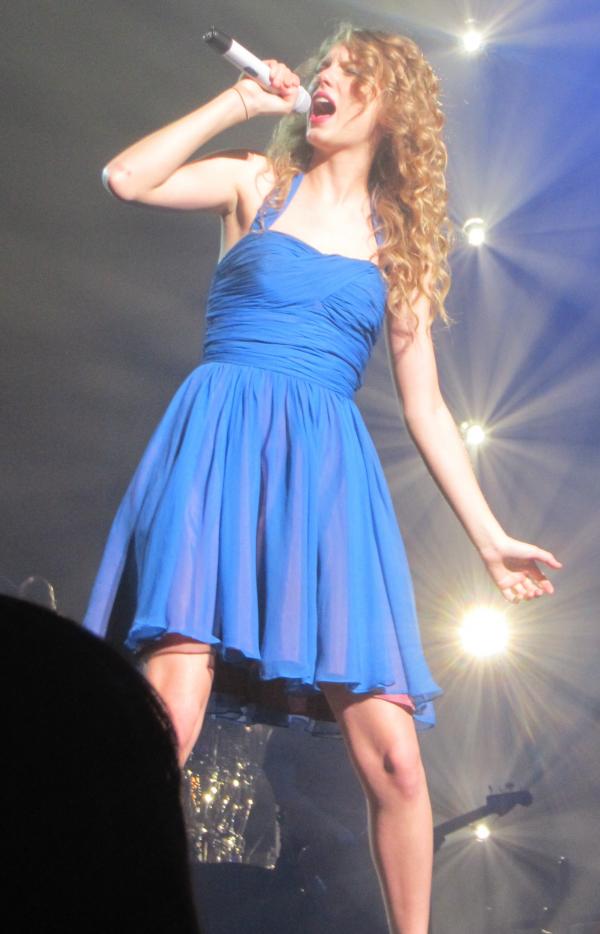
Find the location of a particular element. 4 lights is located at coordinates (478, 229), (468, 432), (498, 639), (494, 854).